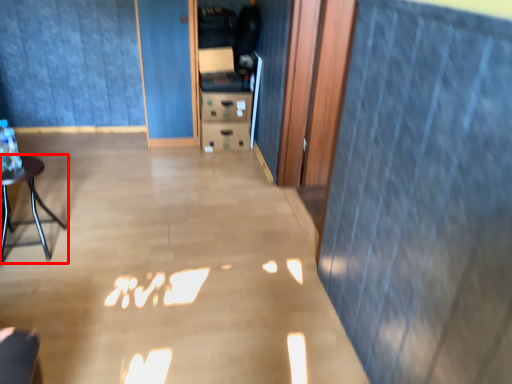
Question: From the image's perspective, what is the correct spatial relationship of furniture (annotated by the red box) in relation to curtain?

Choices:
 (A) above
 (B) below

Answer: (B)